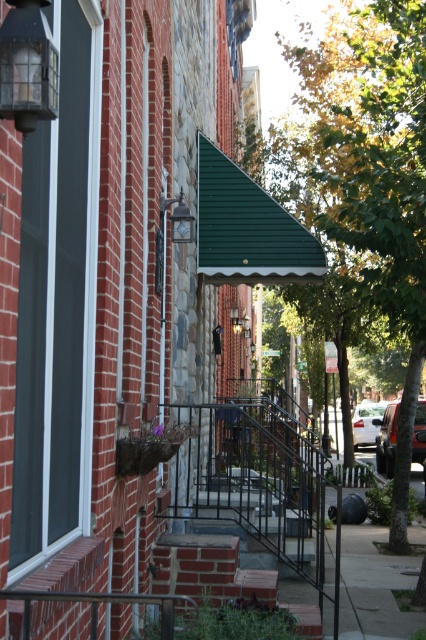
Question: Observing the image, what is the correct spatial positioning of brick stairs at center in reference to clear glass lantern at upper left?

Choices:
 (A) below
 (B) above

Answer: (A)

Question: Which is nearer to the brick stairs at center?

Choices:
 (A) clear glass lantern at upper left
 (B) green leafy tree at center
 (C) green corrugated awning at center

Answer: (A)

Question: Where is brick stairs at center located in relation to clear glass lantern at upper left in the image?

Choices:
 (A) right
 (B) left

Answer: (A)

Question: Which object is the closest to the clear glass lantern at upper left?

Choices:
 (A) brick stairs at center
 (B) green leafy tree at center

Answer: (A)

Question: Considering the relative positions of green corrugated awning at center and brick stairs at center in the image provided, where is green corrugated awning at center located with respect to brick stairs at center?

Choices:
 (A) left
 (B) right

Answer: (B)

Question: Among these points, which one is nearest to the camera?

Choices:
 (A) (189, 556)
 (B) (278, 257)

Answer: (A)